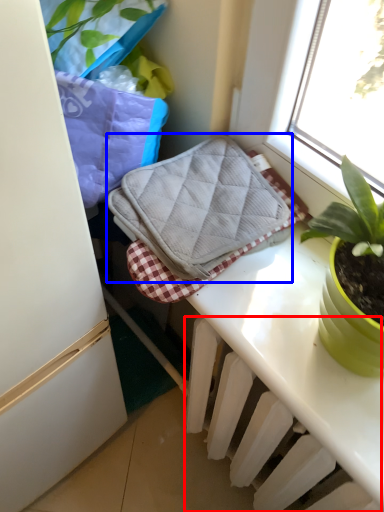
Question: Which of the following is the farthest to the observer, radiator (highlighted by a red box) or bath towel (highlighted by a blue box)?

Choices:
 (A) radiator
 (B) bath towel

Answer: (B)